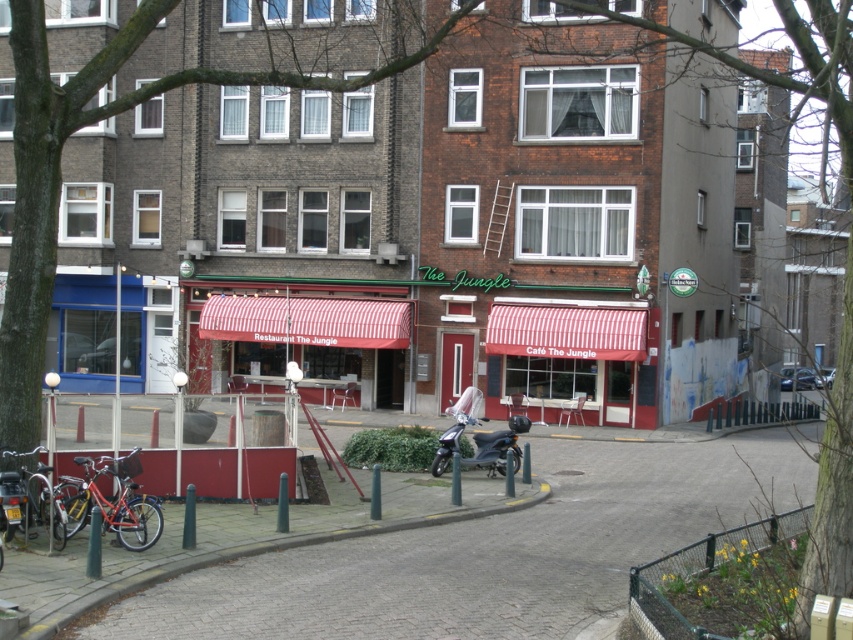
Question: Which point is farther from the camera taking this photo?

Choices:
 (A) (256, 340)
 (B) (512, 454)
 (C) (134, 472)

Answer: (A)

Question: Can you confirm if red striped awning at center is positioned to the left of matte red bicycle at lower left?

Choices:
 (A) yes
 (B) no

Answer: (B)

Question: Which object is the closest to the matte red bicycle at lower left?

Choices:
 (A) red striped awning at center
 (B) metallic silver scooter at center
 (C) red matte bicycle at lower left

Answer: (C)

Question: Which point is closer to the camera taking this photo?

Choices:
 (A) (457, 428)
 (B) (39, 451)

Answer: (B)

Question: Does red striped awning at center have a lesser width compared to red matte bicycle at lower left?

Choices:
 (A) no
 (B) yes

Answer: (A)

Question: Is matte red bicycle at lower left bigger than metallic silver scooter at center?

Choices:
 (A) no
 (B) yes

Answer: (A)